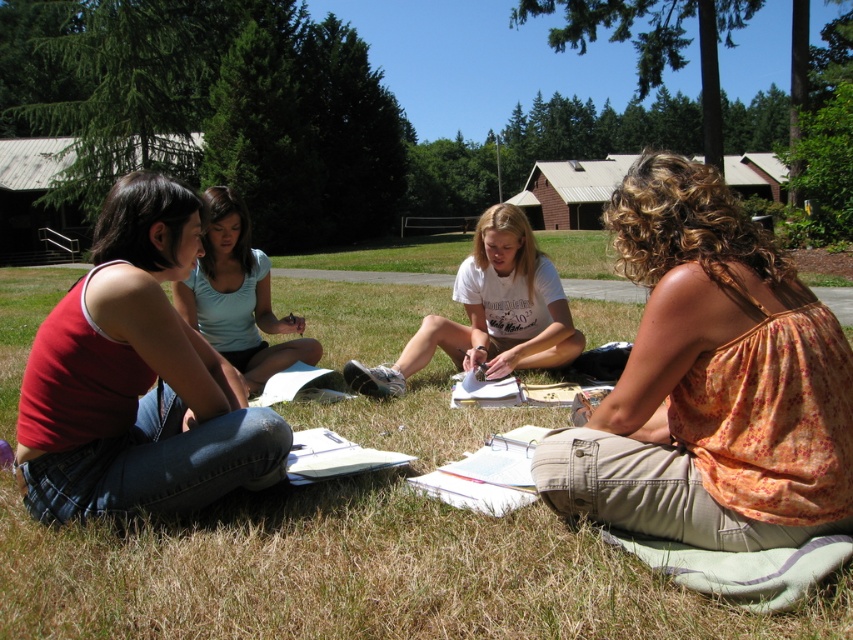
You are a photographer trying to capture a candid shot of the group. You want to ensure that the floral cotton tank top at lower right and the matte red tank top at left are both visible in the frame. Based on their positions, which tank top is closer to the camera?

The floral cotton tank top at lower right is in front of the matte red tank top at left, so it is closer to the camera.

You are standing at the viewpoint of the image and want to reach the point marked at coordinates point (277, 352). There is an obstacle at point (721, 273). Will you have to go around the obstacle to reach your destination?

Yes, you will have to go around the obstacle at point (721, 273) because it is in front of point (277, 352), blocking the direct path.